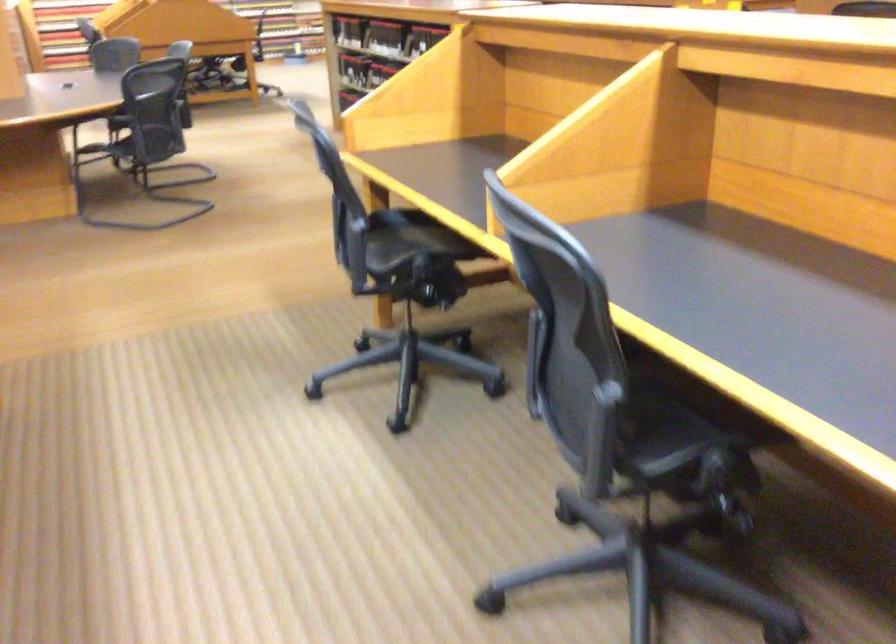
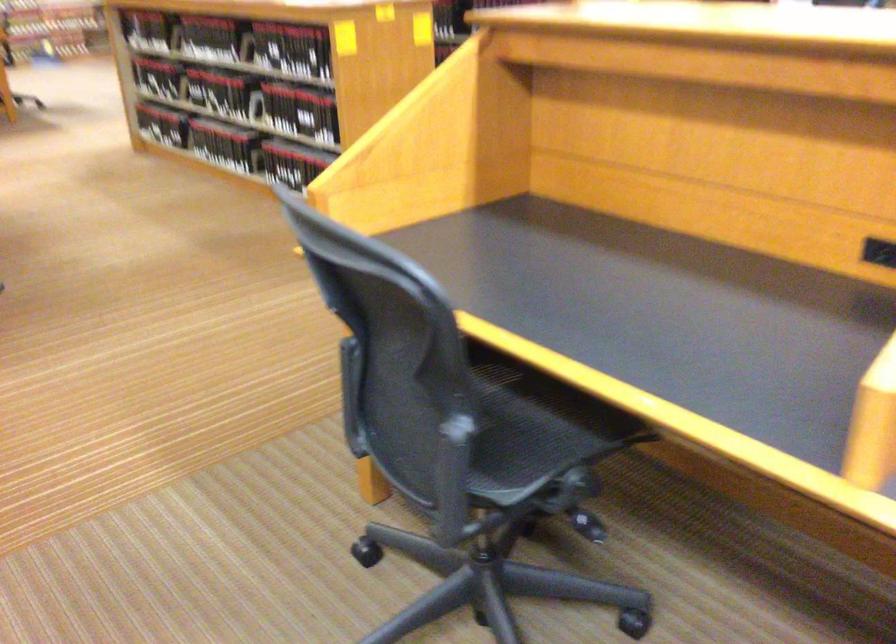
What movement of the cameraman would produce the second image?

The cameraman walked toward left, forward.